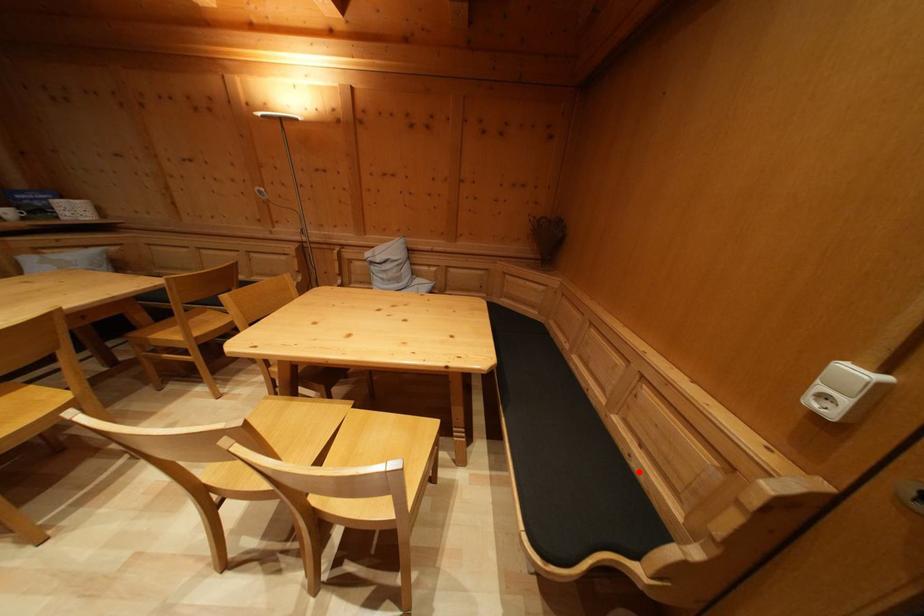
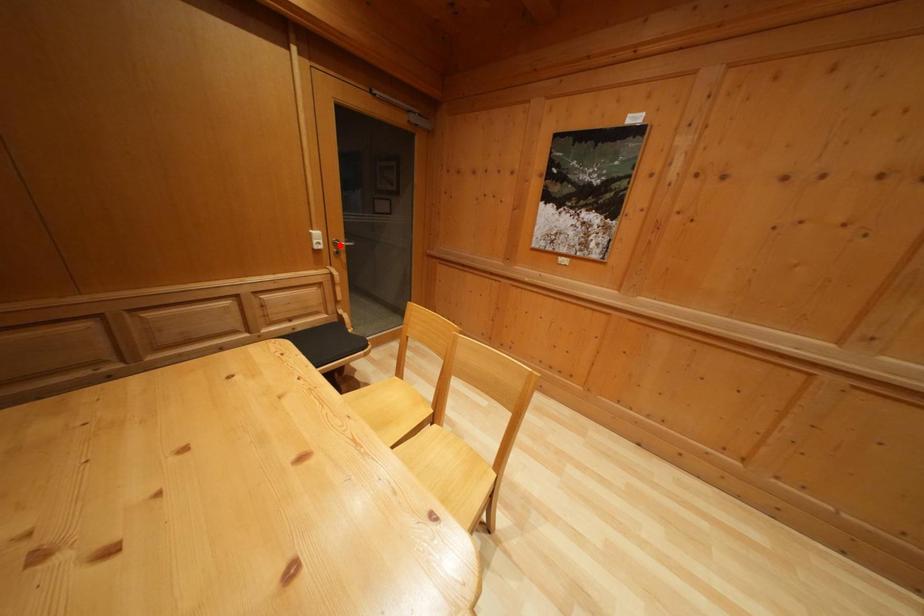
I am providing you with two images of the same scene from different viewpoints. A red point is marked on the first image and another point is marked on the second image. Are the points marked in image1 and image2 representing the same 3D position?

No